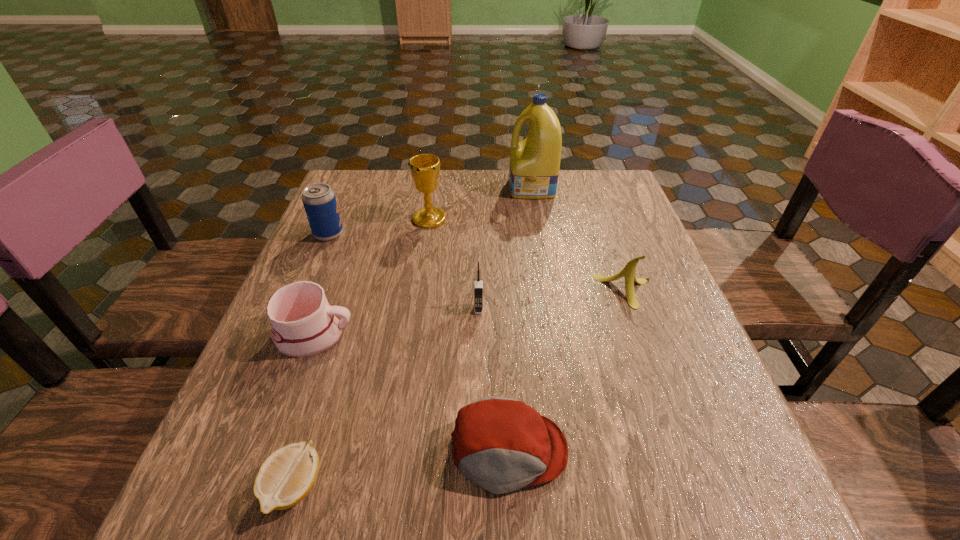
In order to click on vacant area situated on the label of the farthest object in this screenshot , I will do `click(426, 188)`.

At what (x,y) coordinates should I click in order to perform the action: click on vacant space situated 0.100m on the label of the farthest object. Please return your answer as a coordinate pair (x, y). Looking at the image, I should click on (474, 188).

This screenshot has height=540, width=960. Find the location of `vacant space situated on the label of the farthest object`. vacant space situated on the label of the farthest object is located at coordinates (377, 188).

This screenshot has width=960, height=540. I want to click on vacant area situated 0.050m on the right of the second tallest object, so click(466, 219).

Locate an element on the screen. vacant space located 0.390m on the front of the beer can is located at coordinates (269, 375).

Identify the location of vacant region located 0.320m on the front-facing side of the cellular telephone. This screenshot has width=960, height=540. (478, 468).

Where is `free space located on the left of the rightmost object`? free space located on the left of the rightmost object is located at coordinates (486, 291).

Locate an element on the screen. free space located on the side with the handle of the mug is located at coordinates click(394, 335).

This screenshot has height=540, width=960. Identify the location of free space located 0.360m on the right of the lemon. (564, 487).

Where is `detergent that is at the far edge`? detergent that is at the far edge is located at coordinates (535, 161).